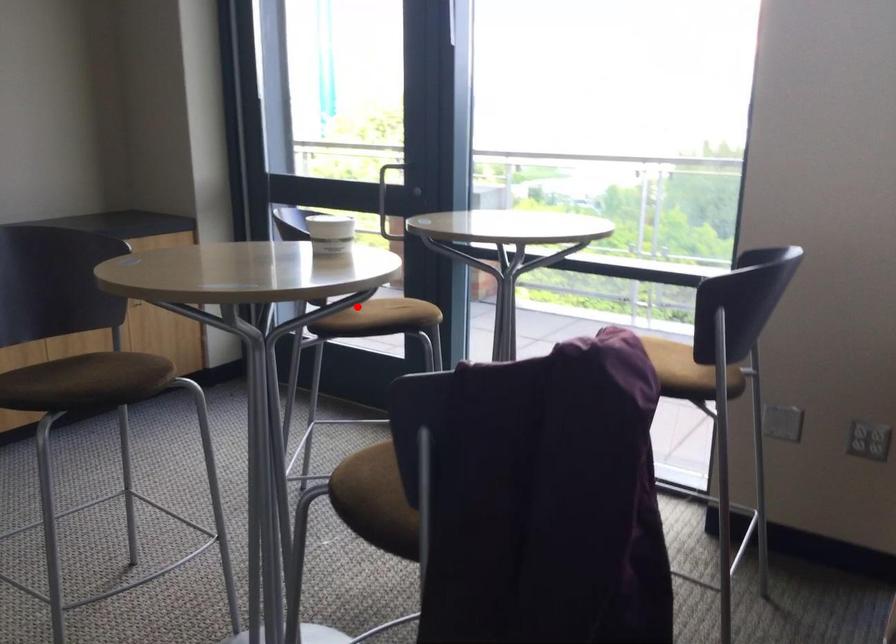
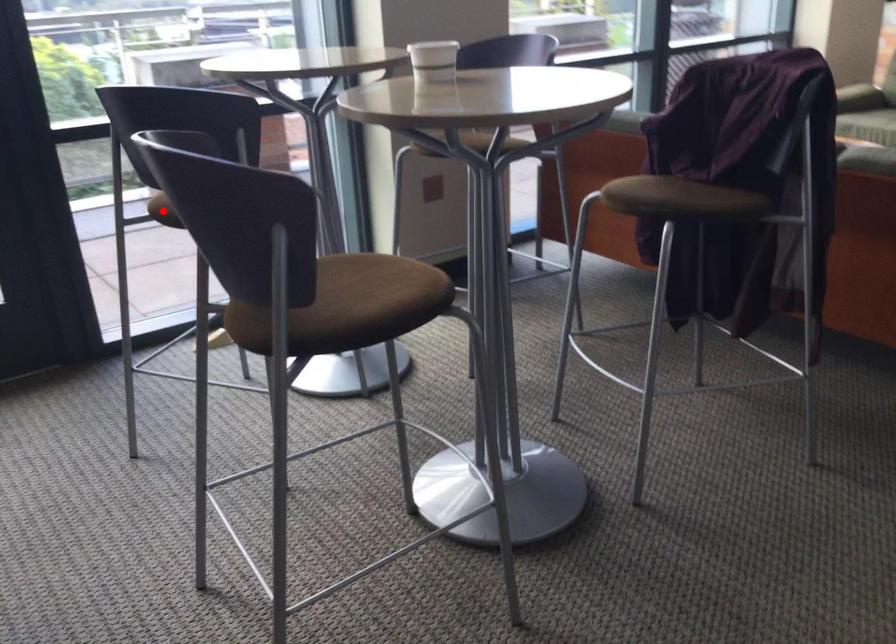
I am providing you with two images of the same scene from different viewpoints. A red point is marked on the first image and another point is marked on the second image. Do the highlighted points in image1 and image2 indicate the same real-world spot?

Yes